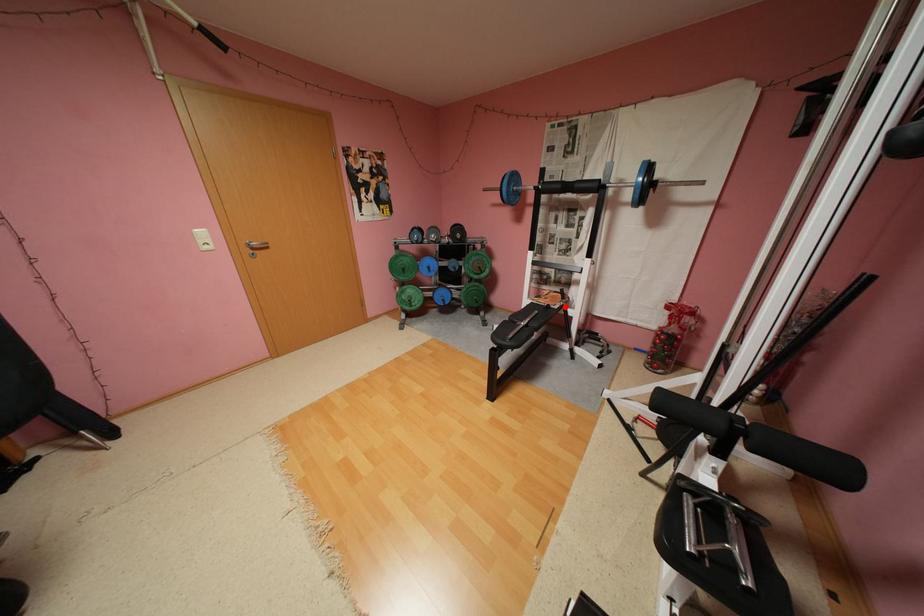
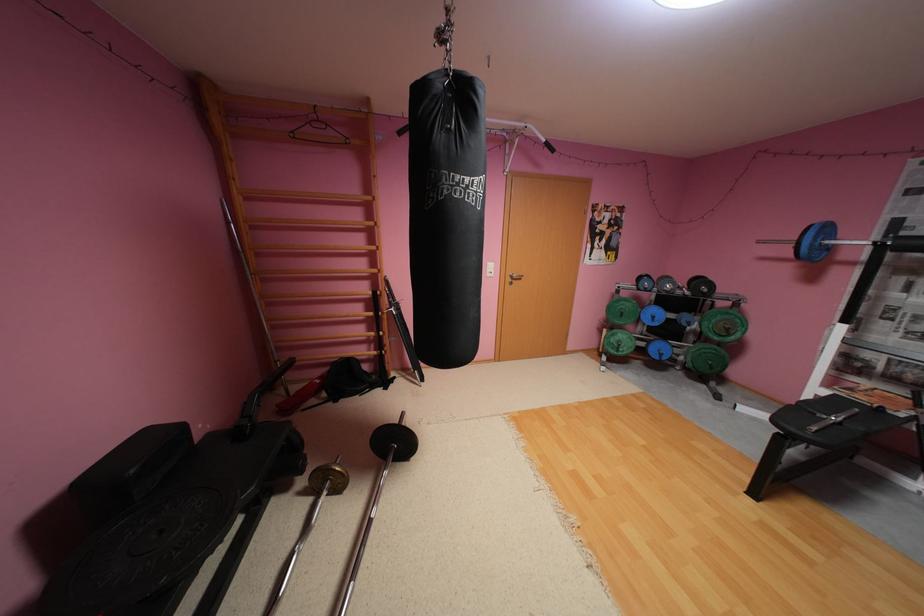
Question: I am providing you with two images of the same scene from different viewpoints. In image1, a red point is highlighted. Considering the same 3D point in image2, which of the following is correct?

Choices:
 (A) It is closer
 (B) It is farther

Answer: (A)